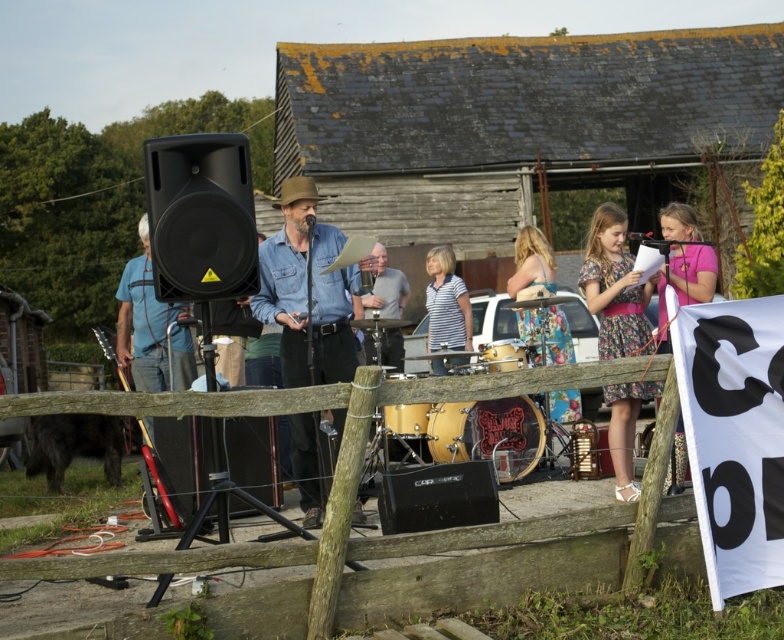
Does denim shirt at center have a greater height compared to black drum at center?

Yes.

Does denim shirt at center appear on the left side of black drum at center?

Yes, denim shirt at center is to the left of black drum at center.

What do you see at coordinates (307, 291) in the screenshot? I see `denim shirt at center` at bounding box center [307, 291].

Find the location of `denim shirt at center`. denim shirt at center is located at coordinates (307, 291).

Is floral dress at center positioned behind gray matte shirt at center?

No.

Does floral dress at center have a greater height compared to gray matte shirt at center?

→ Incorrect, floral dress at center's height is not larger of gray matte shirt at center's.

The height and width of the screenshot is (640, 784). What are the coordinates of `floral dress at center` in the screenshot? It's located at (536, 296).

Is denim shirt at center to the left of matte brown drum at center from the viewer's perspective?

Correct, you'll find denim shirt at center to the left of matte brown drum at center.

Does point (354, 285) come closer to viewer compared to point (400, 372)?

Yes, point (354, 285) is closer to viewer.

Identify the location of denim shirt at center. 307,291.

The height and width of the screenshot is (640, 784). What are the coordinates of `denim shirt at center` in the screenshot? It's located at (307, 291).